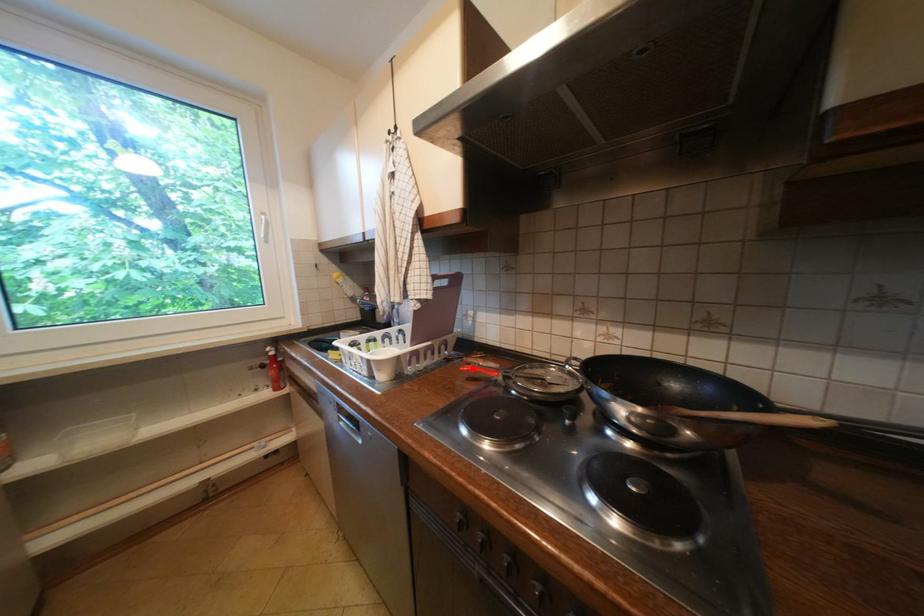
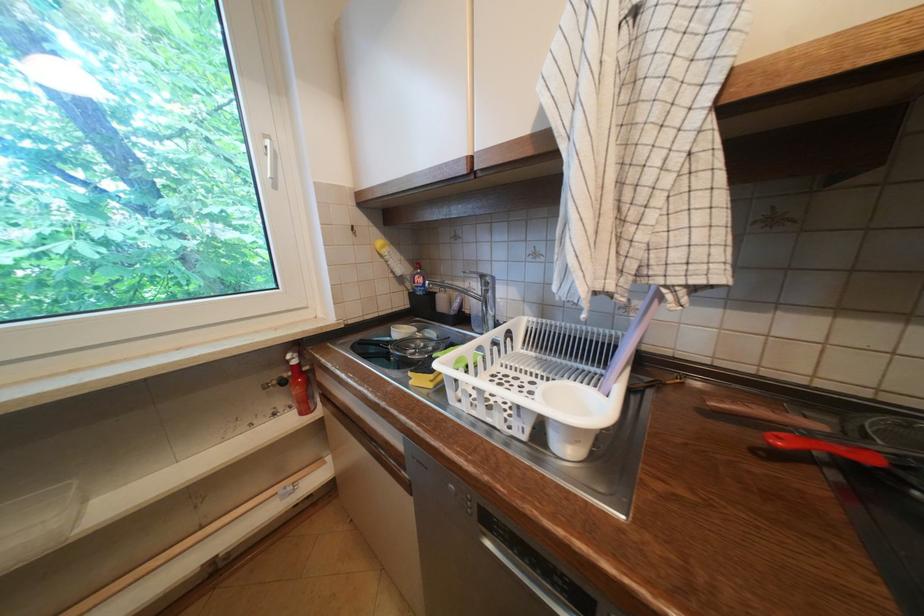
Locate, in the second image, the point that corresponds to the highlighted location in the first image.

(788, 440)